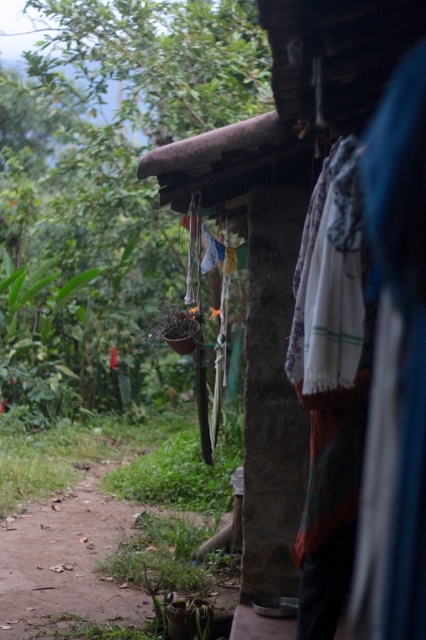
Based on the photo, you are standing in front of the rustic wooden hut at center and want to place a small garden gnome that is 1.2 meters tall. Can the green leafy plant at center block the gnome from being seen from your current position?

The green leafy plant at center has a lesser height compared to rustic wooden hut at center. Since the gnome is 1.2 meters tall and the plant is shorter than the hut, but we don not have the exact height of the plant, it is uncertain if the gnome will be blocked. However, if the plant is shorter than the gnome, it might not block the view. Further information about the plant height is needed for a definitive answer.

What are the coordinates of the green leafy plant at center in the image?

The green leafy plant at center is located at coordinates (x=120, y=147).

You are standing in front of the rustic wooden hut at center and want to water the green leafy plant at center. Can you easily reach it with a watering can?

The green leafy plant at center is located above the rustic wooden hut at center, so it might be difficult to reach with a watering can from the ground level.